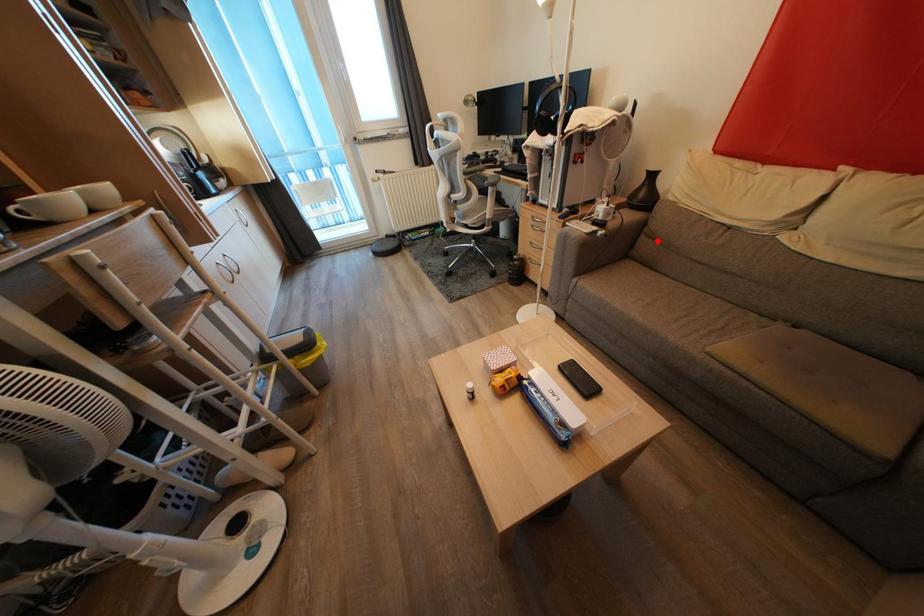
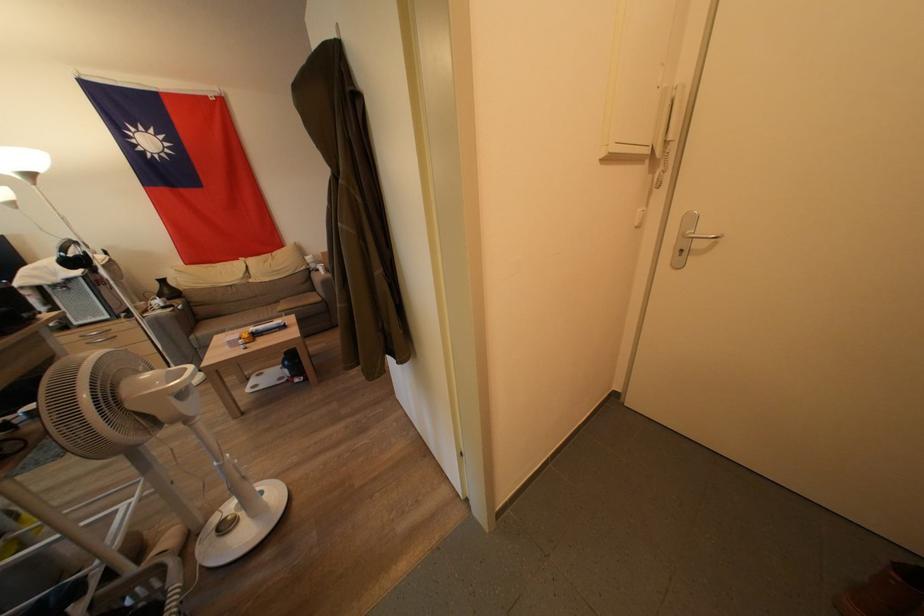
Where in the second image is the point corresponding to the highlighted location from the first image?

(207, 309)